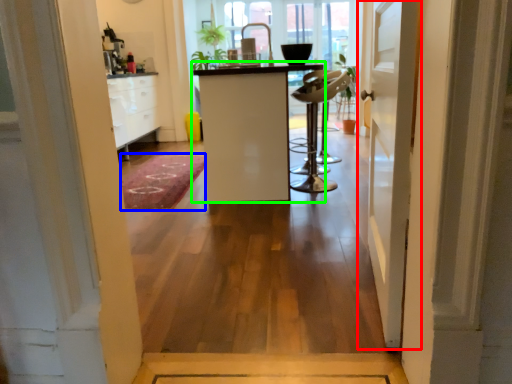
Question: Considering the real-world distances, which object is closest to door (highlighted by a red box)? doormat (highlighted by a blue box) or furniture (highlighted by a green box).

Choices:
 (A) doormat
 (B) furniture

Answer: (B)